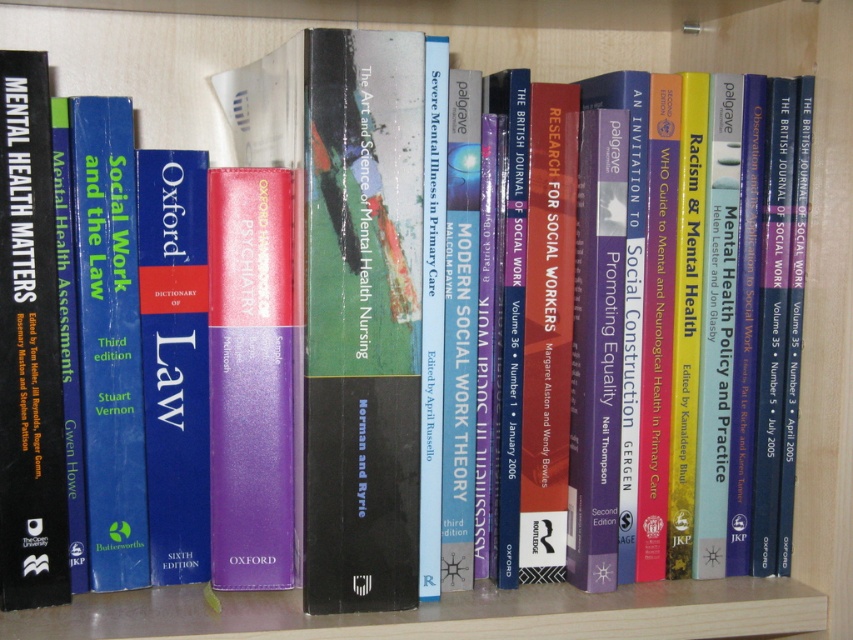
Is the position of hardcover book at center less distant than that of blue hardcover dictionary of law at center?

Yes, hardcover book at center is closer to the viewer.

Which is below, hardcover book at center or blue hardcover dictionary of law at center?

blue hardcover dictionary of law at center

The height and width of the screenshot is (640, 853). Describe the element at coordinates (363, 320) in the screenshot. I see `hardcover book at center` at that location.

The image size is (853, 640). I want to click on hardcover book at center, so click(x=363, y=320).

Who is lower down, purple hardcover book at center or black matte book at left?

purple hardcover book at center is lower down.

Is purple hardcover book at center positioned in front of black matte book at left?

No.

Which is behind, point (244, 355) or point (24, 472)?

The point (244, 355) is behind.

Locate an element on the screen. purple hardcover book at center is located at coordinates (250, 378).

Does hardcover book at center appear on the left side of blue hardcover book at left?

In fact, hardcover book at center is to the right of blue hardcover book at left.

Which is more to the right, hardcover book at center or blue hardcover book at left?

Positioned to the right is hardcover book at center.

Where is `hardcover book at center`? The height and width of the screenshot is (640, 853). hardcover book at center is located at coordinates (363, 320).

The height and width of the screenshot is (640, 853). I want to click on hardcover book at center, so click(363, 320).